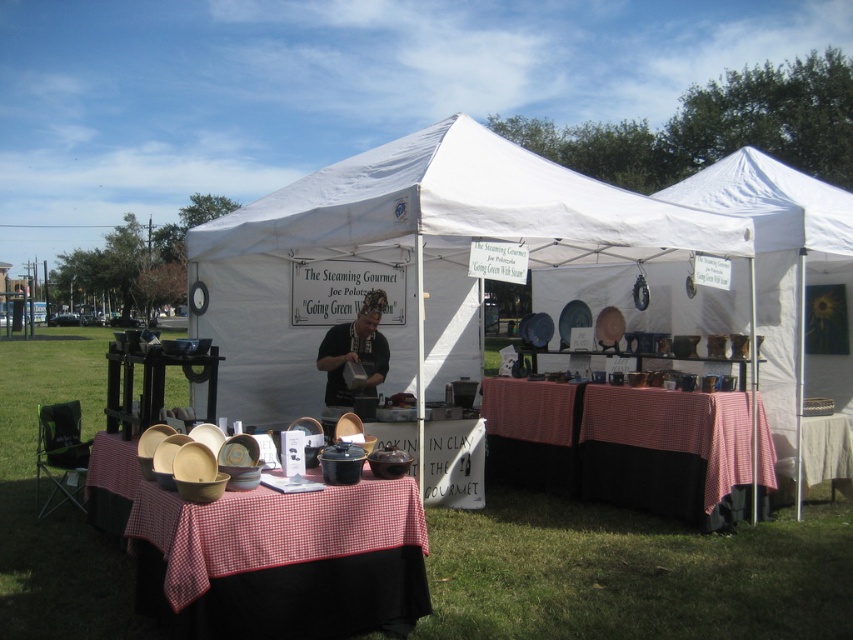
You are a customer at the market and want to sit down at the checkered fabric picnic table at center. However, you are wearing a matte black shirt at center. Is there enough space for you to sit comfortably at the table?

The checkered fabric picnic table at center has a width larger than the matte black shirt at center, so there is enough space for you to sit comfortably at the table.

You are standing at the entrance of the market and want to locate the white fabric tent at center. According to the coordinates provided, where should you look to find it?

The white fabric tent at center is located at coordinates point (413, 253).

You are setting up a booth for an eco fair and need to decide where to place a large banner. The banner requires a surface that can support its weight. Given the scene, which object between the white fabric tent at center and the checkered fabric picnic table at center would be more suitable for hanging the banner?

The white fabric tent at center is bigger than the checkered fabric picnic table at center, so it would likely be more suitable for hanging the banner as it can provide a sturdier and larger surface area to support the banner.